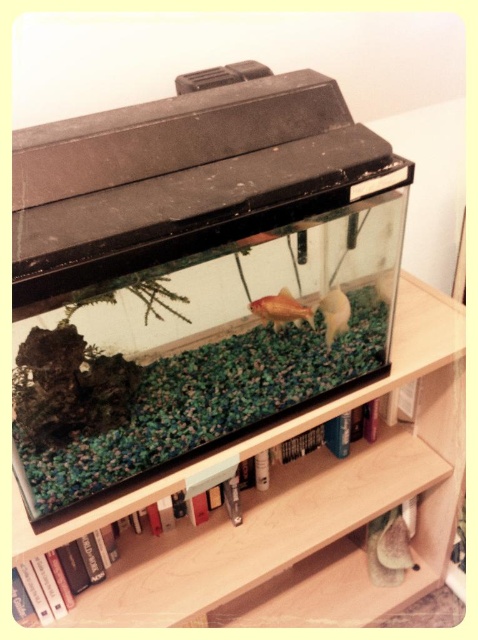
Is translucent glass bookshelf at center thinner than goldfish at center?

No.

In the scene shown: Is translucent glass bookshelf at center below goldfish at center?

Indeed, translucent glass bookshelf at center is positioned under goldfish at center.

Does point (166, 490) come in front of point (288, 317)?

No.

I want to click on translucent glass bookshelf at center, so click(x=299, y=506).

Does point (421, 417) lie behind point (335, 321)?

Yes, point (421, 417) is farther from viewer.

Which is above, translucent glass bookshelf at center or gold shiny fish at center?

gold shiny fish at center is above.

Between point (414, 486) and point (337, 321), which one is positioned in front?

Point (337, 321)

The image size is (478, 640). Identify the location of translucent glass bookshelf at center. (299, 506).

From the picture: Is goldfish at center to the left of gold shiny fish at center from the viewer's perspective?

Correct, you'll find goldfish at center to the left of gold shiny fish at center.

Which is behind, point (303, 304) or point (321, 298)?

The point (321, 298) is behind.

Does point (272, 323) come behind point (347, 310)?

No, it is in front of (347, 310).

The image size is (478, 640). In order to click on goldfish at center in this screenshot , I will do `click(281, 308)`.